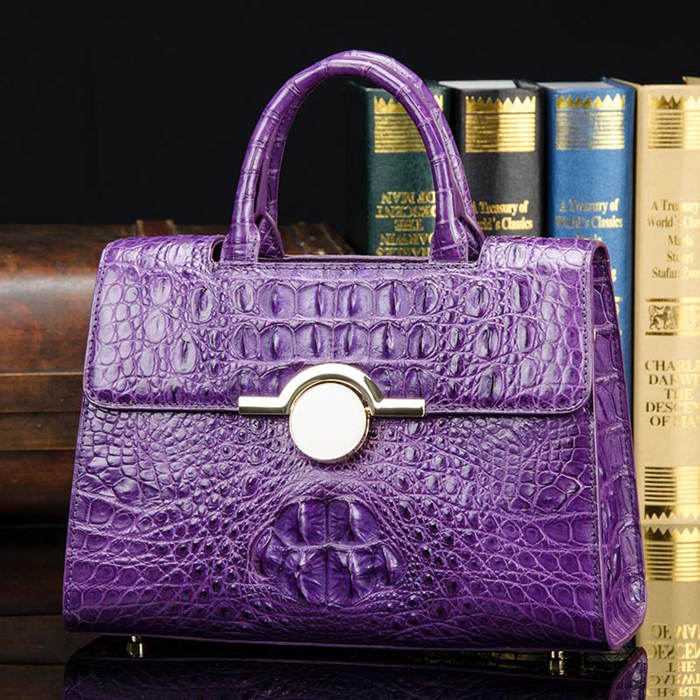
What are the coordinates of `tan book cover` in the screenshot? It's located at (677, 178).